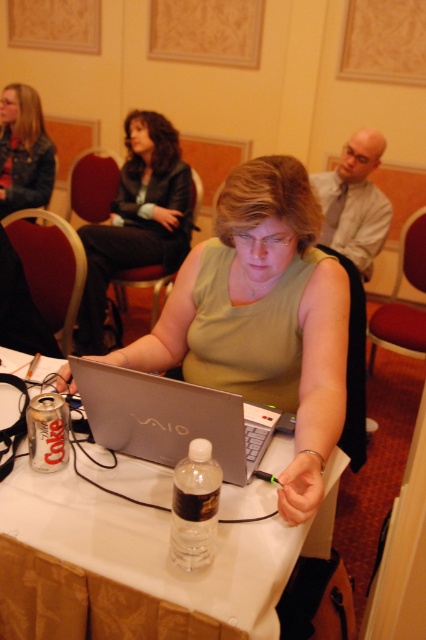
Question: Which point is closer to the camera taking this photo?

Choices:
 (A) (155, 241)
 (B) (275, 612)
 (C) (25, 173)
 (D) (157, 388)

Answer: (B)

Question: Does white plastic table at center have a lesser width compared to green matte shirt at center?

Choices:
 (A) yes
 (B) no

Answer: (B)

Question: Does matte black jacket at upper left have a smaller size compared to clear plastic bottle at center?

Choices:
 (A) no
 (B) yes

Answer: (A)

Question: Based on their relative distances, which object is farther from the white plastic table at center?

Choices:
 (A) matte black jacket at upper left
 (B) green matte shirt at center
 (C) clear plastic bottle at center
 (D) silver metallic laptop at center

Answer: (A)

Question: Does white plastic table at center have a larger size compared to matte black jacket at upper left?

Choices:
 (A) no
 (B) yes

Answer: (B)

Question: Which point appears farthest from the camera in this image?

Choices:
 (A) (32, 102)
 (B) (181, 259)
 (C) (120, 632)

Answer: (A)